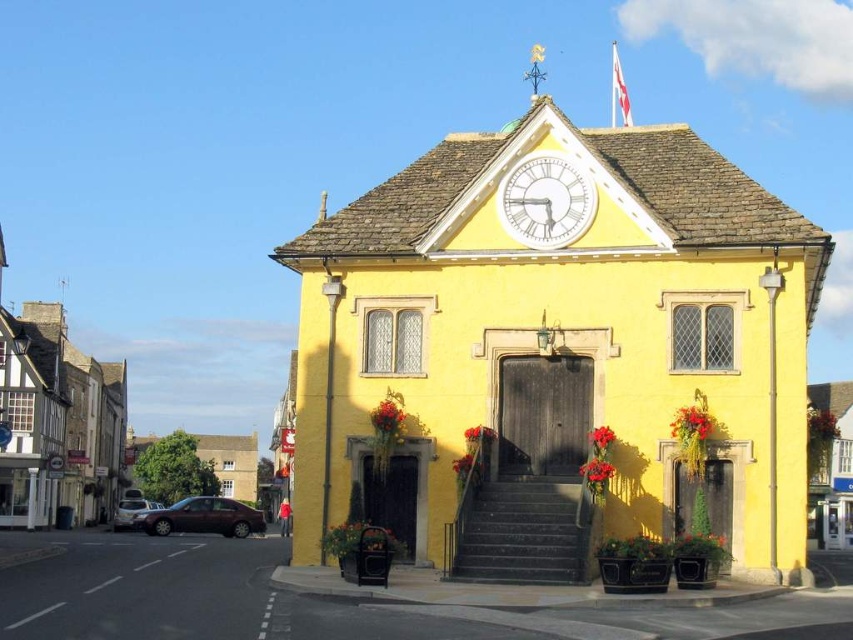
Can you confirm if yellow stone church at center is bigger than dark gray stone stairs at center?

Indeed, yellow stone church at center has a larger size compared to dark gray stone stairs at center.

Looking at this image, can you confirm if yellow stone church at center is wider than dark gray stone stairs at center?

Yes, yellow stone church at center is wider than dark gray stone stairs at center.

Identify the location of yellow stone church at center. This screenshot has height=640, width=853. (556, 356).

Which is behind, point (485, 524) or point (550, 211)?

The point (550, 211) is more distant.

Between point (579, 572) and point (543, 184), which one is positioned in front?

Point (579, 572) is in front.

This screenshot has width=853, height=640. What are the coordinates of `dark gray stone stairs at center` in the screenshot? It's located at (524, 531).

Can you confirm if yellow stone church at center is positioned to the right of white glass clock at upper center?

Correct, you'll find yellow stone church at center to the right of white glass clock at upper center.

Is yellow stone church at center shorter than white glass clock at upper center?

In fact, yellow stone church at center may be taller than white glass clock at upper center.

Who is more distant from viewer, (369, 225) or (534, 216)?

Point (369, 225)

At what (x,y) coordinates should I click in order to perform the action: click on yellow stone church at center. Please return your answer as a coordinate pair (x, y). Image resolution: width=853 pixels, height=640 pixels. Looking at the image, I should click on 556,356.